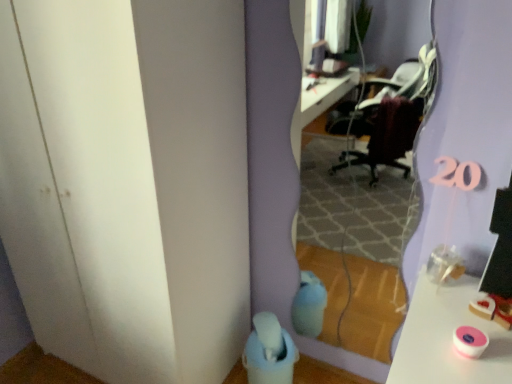
Question: Can you confirm if clear glass mirror at center is taller than transparent plastic door at lower left?

Choices:
 (A) yes
 (B) no

Answer: (B)

Question: Can you confirm if clear glass mirror at center is positioned to the left of transparent plastic door at lower left?

Choices:
 (A) yes
 (B) no

Answer: (B)

Question: From the image's perspective, is clear glass mirror at center on transparent plastic door at lower left?

Choices:
 (A) yes
 (B) no

Answer: (B)

Question: Is clear glass mirror at center shorter than transparent plastic door at lower left?

Choices:
 (A) yes
 (B) no

Answer: (A)

Question: Is clear glass mirror at center bigger than transparent plastic door at lower left?

Choices:
 (A) no
 (B) yes

Answer: (A)

Question: Considering the relative sizes of clear glass mirror at center and transparent plastic door at lower left in the image provided, is clear glass mirror at center smaller than transparent plastic door at lower left?

Choices:
 (A) no
 (B) yes

Answer: (B)

Question: Is transparent plastic door at lower left further to camera compared to clear glass mirror at center?

Choices:
 (A) no
 (B) yes

Answer: (A)

Question: Is transparent plastic door at lower left beside clear glass mirror at center?

Choices:
 (A) yes
 (B) no

Answer: (B)

Question: Is transparent plastic door at lower left to the left of clear glass mirror at center from the viewer's perspective?

Choices:
 (A) no
 (B) yes

Answer: (B)

Question: Is transparent plastic door at lower left not within clear glass mirror at center?

Choices:
 (A) no
 (B) yes

Answer: (B)

Question: From the image's perspective, is transparent plastic door at lower left beneath clear glass mirror at center?

Choices:
 (A) yes
 (B) no

Answer: (B)

Question: Does transparent plastic door at lower left have a larger size compared to clear glass mirror at center?

Choices:
 (A) no
 (B) yes

Answer: (B)

Question: Relative to clear glass mirror at center, is transparent plastic door at lower left in front or behind?

Choices:
 (A) behind
 (B) front

Answer: (B)